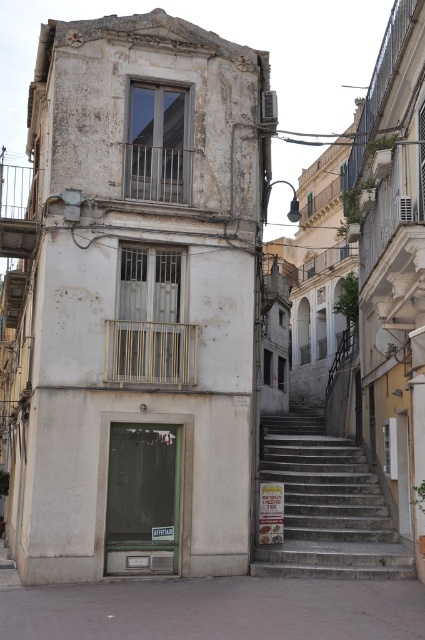
From the picture: You are standing on the concrete pavement at lower center. What are the coordinates of the point where you are standing?

The coordinates of the point where you are standing on the concrete pavement at lower center are (215, 609).

You are standing at the bottom of the street and want to reach the building at the center. Which object should you step onto first, the concrete pavement at lower center or the stone stairs at center?

You should step onto the concrete pavement at lower center first because it is positioned under the stone stairs at center, making it the lower and initial surface to access the stairs.

You are a delivery person carrying a heavy package. You need to reach the building at the center of the image. Which path would require fewer steps? The concrete pavement at lower center or the stone stairs at center?

The concrete pavement at lower center is shorter than the stone stairs at center, so the concrete pavement at lower center would require fewer steps.